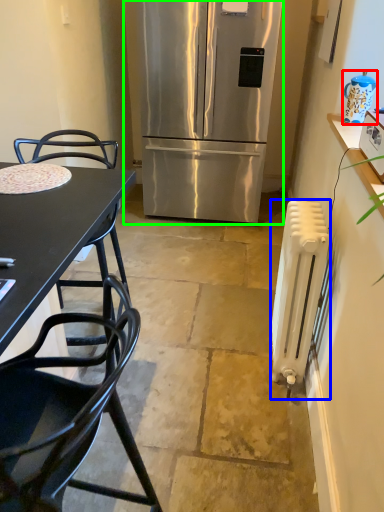
Question: Which object is the closest to the appliance (highlighted by a red box)? Choose among these: radiator (highlighted by a blue box) or refrigerator (highlighted by a green box).

Choices:
 (A) radiator
 (B) refrigerator

Answer: (A)